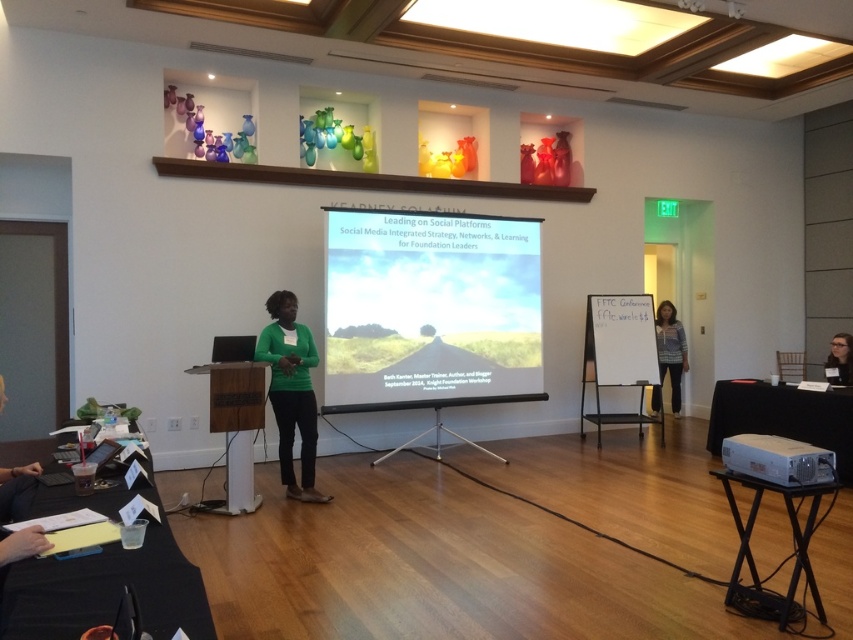
Between green matte shirt at center and striped sweater at right, which one is positioned lower?

Positioned lower is green matte shirt at center.

The width and height of the screenshot is (853, 640). Describe the element at coordinates (291, 392) in the screenshot. I see `green matte shirt at center` at that location.

Is point (271, 310) positioned behind point (679, 372)?

That is False.

I want to click on green matte shirt at center, so click(x=291, y=392).

Where is `striped sweater at right`? striped sweater at right is located at coordinates (669, 355).

Consider the image. Is striped sweater at right wider than matte black glasses at upper right?

Indeed, striped sweater at right has a greater width compared to matte black glasses at upper right.

Does point (676, 340) come closer to viewer compared to point (834, 349)?

No, (676, 340) is behind (834, 349).

Locate an element on the screen. The width and height of the screenshot is (853, 640). striped sweater at right is located at coordinates (669, 355).

Does matte white projector screen at center come behind matte black glasses at upper right?

No.

Which of these two, matte white projector screen at center or matte black glasses at upper right, stands taller?

With more height is matte white projector screen at center.

Is point (415, 244) more distant than point (840, 336)?

That is False.

Where is `matte white projector screen at center`? matte white projector screen at center is located at coordinates (430, 308).